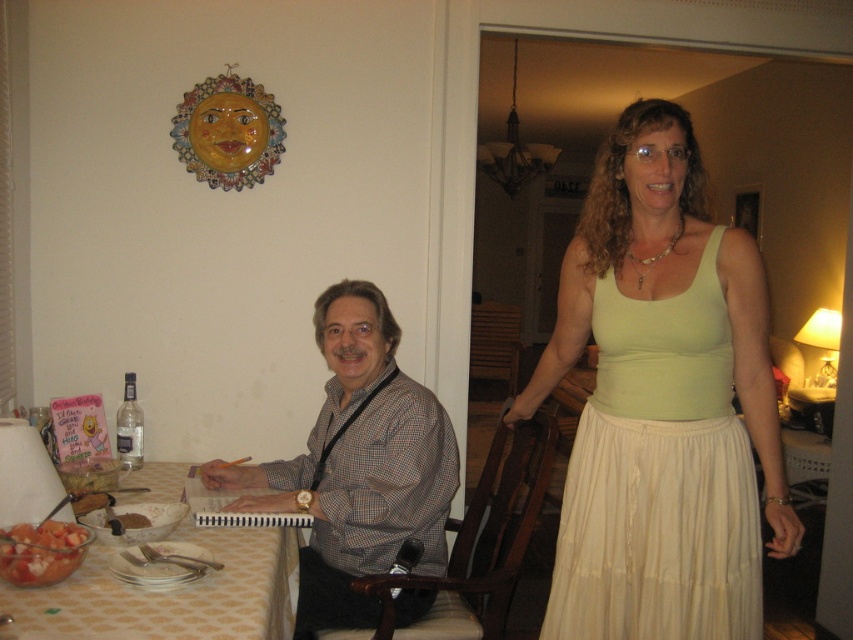
From the picture: Is checkered fabric shirt at center shorter than patterned fabric table at lower left?

In fact, checkered fabric shirt at center may be taller than patterned fabric table at lower left.

Is checkered fabric shirt at center behind patterned fabric table at lower left?

Yes.

Where is `checkered fabric shirt at center`? checkered fabric shirt at center is located at coordinates (357, 465).

Who is positioned more to the left, light green fabric skirt at right or patterned fabric table at lower left?

From the viewer's perspective, patterned fabric table at lower left appears more on the left side.

Is point (692, 506) in front of point (198, 540)?

Yes.

This screenshot has height=640, width=853. I want to click on light green fabric skirt at right, so click(x=659, y=477).

How much distance is there between light green fabric dress at right and brown crumbly bread at table?

The distance of light green fabric dress at right from brown crumbly bread at table is 3.40 feet.

Is light green fabric dress at right to the right of brown crumbly bread at table from the viewer's perspective?

Correct, you'll find light green fabric dress at right to the right of brown crumbly bread at table.

At what (x,y) coordinates should I click in order to perform the action: click on light green fabric dress at right. Please return your answer as a coordinate pair (x, y). Looking at the image, I should click on (662, 403).

Locate an element on the screen. The width and height of the screenshot is (853, 640). light green fabric dress at right is located at coordinates (662, 403).